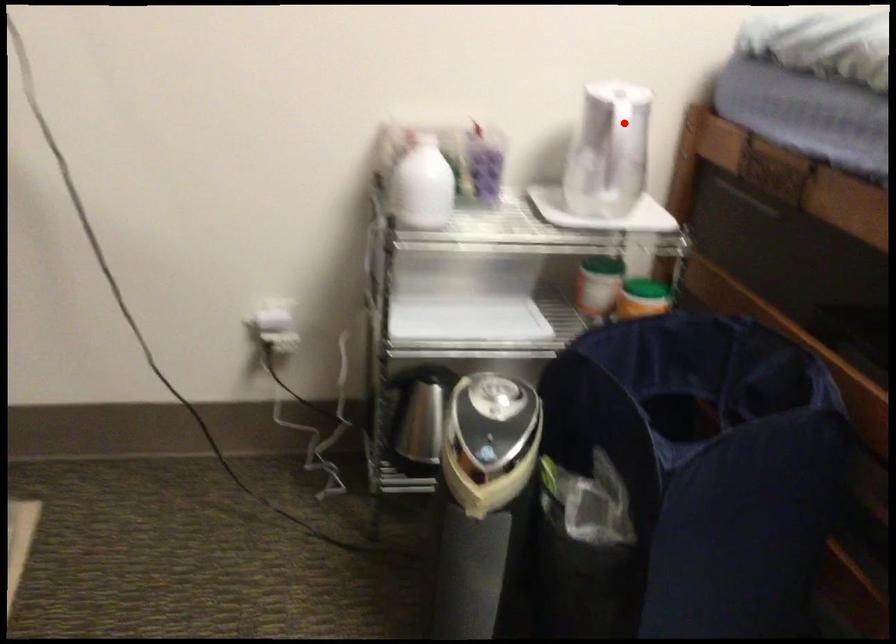
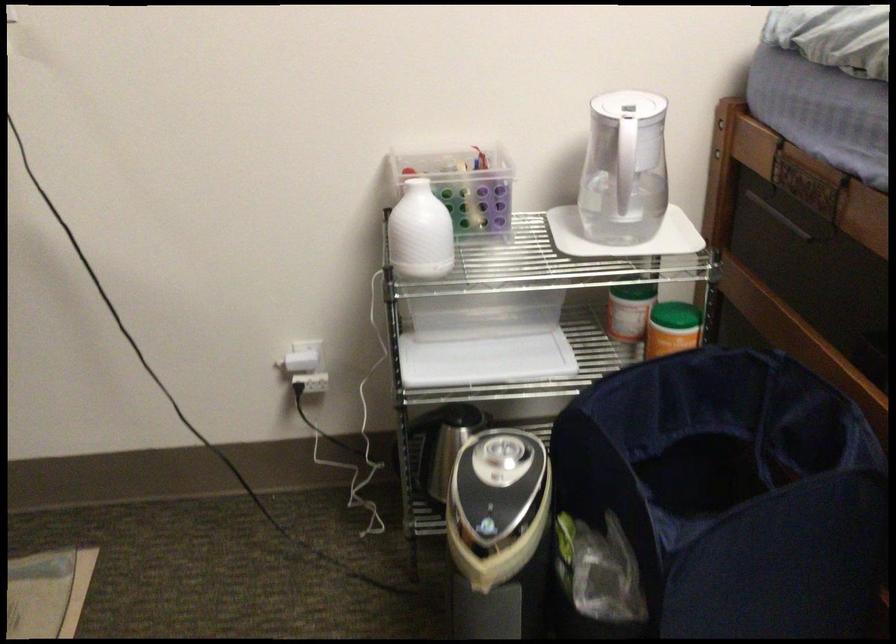
The point at the highlighted location is marked in the first image. Where is the corresponding point in the second image?

(630, 144)